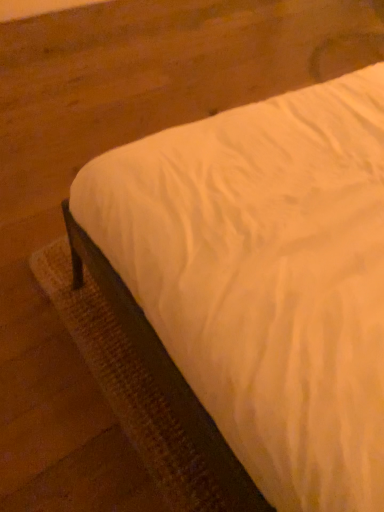
What do you see at coordinates (266, 278) in the screenshot? Image resolution: width=384 pixels, height=512 pixels. I see `white matte bed at center` at bounding box center [266, 278].

Where is `white matte bed at center`? This screenshot has height=512, width=384. white matte bed at center is located at coordinates (266, 278).

This screenshot has width=384, height=512. Find the location of `white matte bed at center`. white matte bed at center is located at coordinates (266, 278).